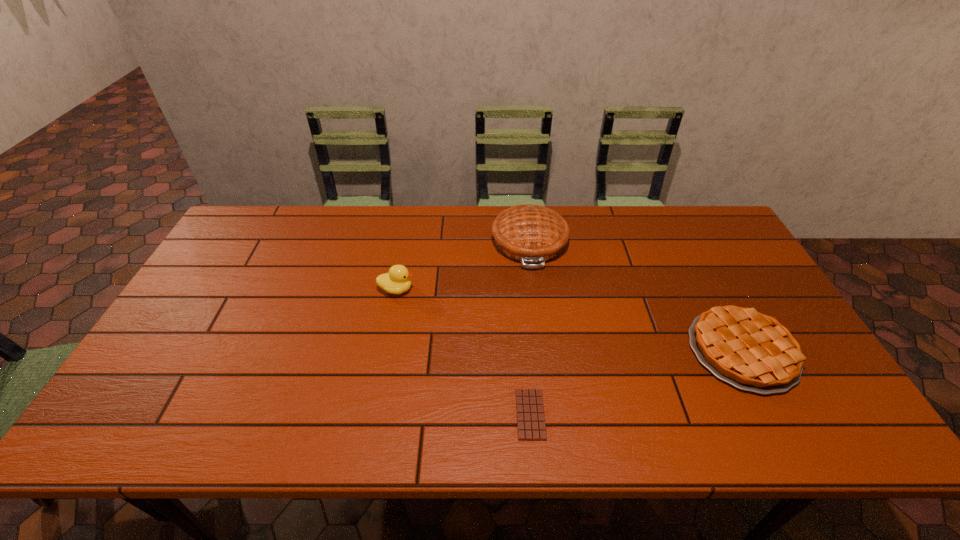
This screenshot has height=540, width=960. In order to click on the taller pie in this screenshot , I will do `click(530, 234)`.

Find the location of `the farther pie`. the farther pie is located at coordinates (530, 234).

Where is `the third nearest object`? the third nearest object is located at coordinates (397, 281).

What are the coordinates of `the leftmost object` in the screenshot? It's located at (397, 281).

Where is `the nearer pie`? Image resolution: width=960 pixels, height=540 pixels. the nearer pie is located at coordinates click(753, 352).

You are a GUI agent. You are given a task and a screenshot of the screen. Output one action in this format:
    pyautogui.click(x=<x>, y=<y>)
    Task: Click on the right pie
    Image resolution: width=960 pixels, height=540 pixels.
    Given the screenshot: What is the action you would take?
    pyautogui.click(x=753, y=352)

Locate an element on the screen. the shortest object is located at coordinates (531, 426).

The image size is (960, 540). I want to click on blank space located 0.330m on the front of the farthest object, so click(544, 362).

Identify the location of free space located on the beak of the duckling. (473, 289).

The image size is (960, 540). I want to click on free space located 0.310m on the left of the third tallest object, so click(569, 350).